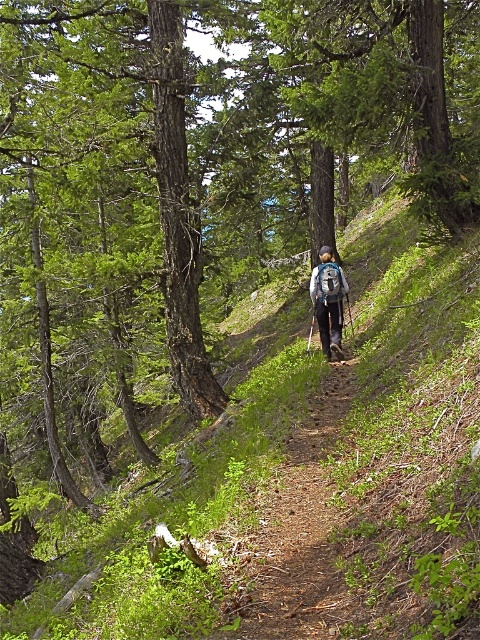
You are a hiker planning to place a 3.5 meter long tent on the trail. Given the distance between the brown dirt path at center and the blue fabric backpack at center, will the tent fit along the path without overlapping either object?

The distance between the brown dirt path at center and the blue fabric backpack at center is 4.29 meters. Since the tent is 3.5 meters long, it can fit within this space without overlapping either object.

You are a hiker on the trail and want to place a marker at point A and point B. Given that point A is at coordinate point(302, 538) and point B is at coordinate point(317, 272), which point is closer to your current position if you are standing at the starting point of the trail?

Point A at coordinate point(302, 538) is closer to your current position because it is in front of point B at coordinate point(317, 272).